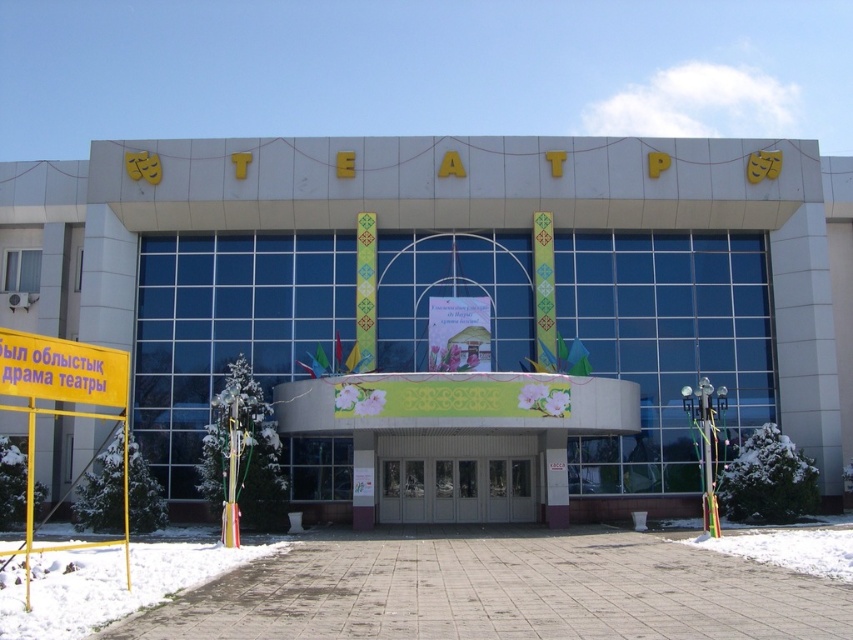
From the picture: Does metallic glass doors at center have a lesser width compared to white powdery snow at lower center?

Yes, metallic glass doors at center is thinner than white powdery snow at lower center.

Is metallic glass doors at center to the right of white powdery snow at lower center from the viewer's perspective?

No, metallic glass doors at center is not to the right of white powdery snow at lower center.

Between point (396, 472) and point (792, 552), which one is positioned in front?

Point (792, 552) is more forward.

Where is `metallic glass doors at center`? metallic glass doors at center is located at coordinates (456, 490).

Can you confirm if white powdery snow at lower left is thinner than yellow/yellowish paper sign at lower left?

No, white powdery snow at lower left is not thinner than yellow/yellowish paper sign at lower left.

In order to click on white powdery snow at lower left in this screenshot , I will do (x=108, y=584).

Is point (90, 588) positioned after point (78, 394)?

Yes, point (90, 588) is behind point (78, 394).

Locate an element on the screen. The width and height of the screenshot is (853, 640). white powdery snow at lower left is located at coordinates (108, 584).

Can you confirm if metallic glass doors at center is positioned to the right of yellow/yellowish paper sign at lower left?

Correct, you'll find metallic glass doors at center to the right of yellow/yellowish paper sign at lower left.

Between metallic glass doors at center and yellow/yellowish paper sign at lower left, which one appears on the right side from the viewer's perspective?

metallic glass doors at center is more to the right.

Is point (466, 500) positioned before point (27, 358)?

No, (466, 500) is behind (27, 358).

Identify the location of metallic glass doors at center. (456, 490).